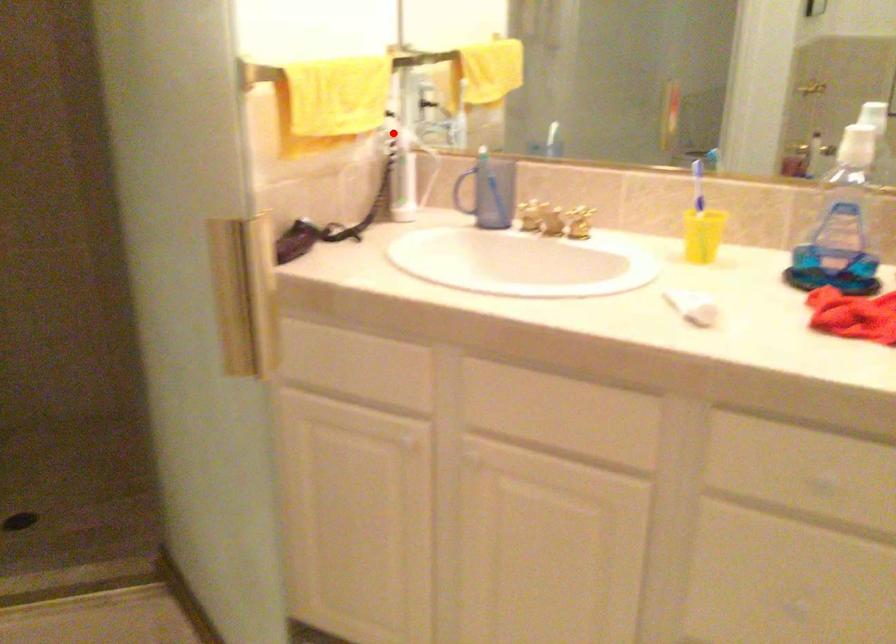
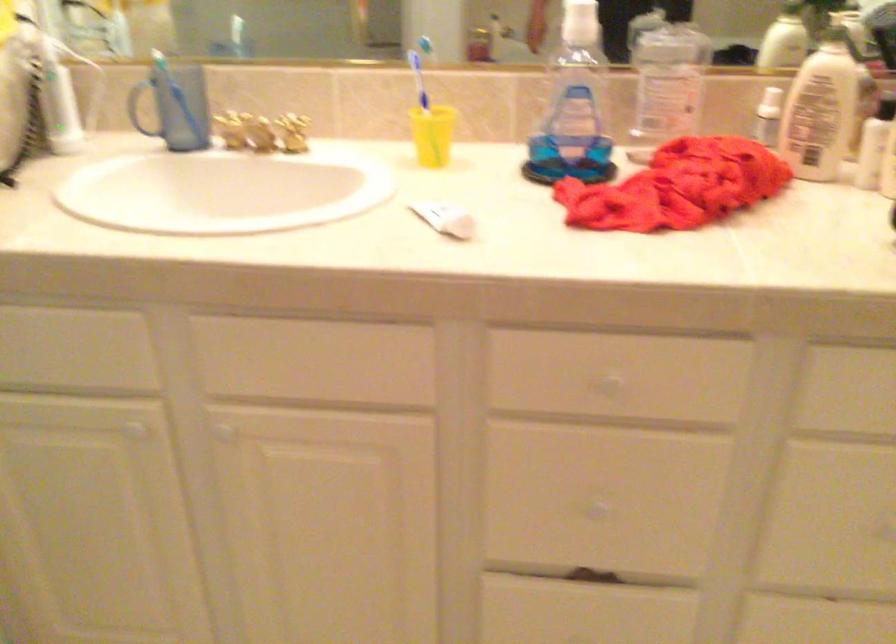
Question: I am providing you with two images of the same scene from different viewpoints. A red point is shown in image1. For the corresponding object point in image2, is it positioned nearer or farther from the camera?

Choices:
 (A) Nearer
 (B) Farther

Answer: (A)